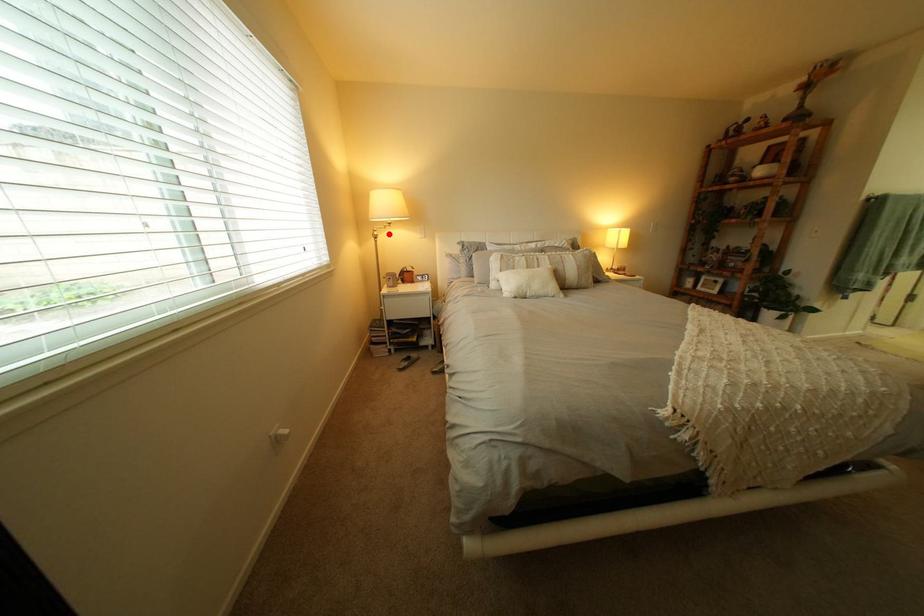
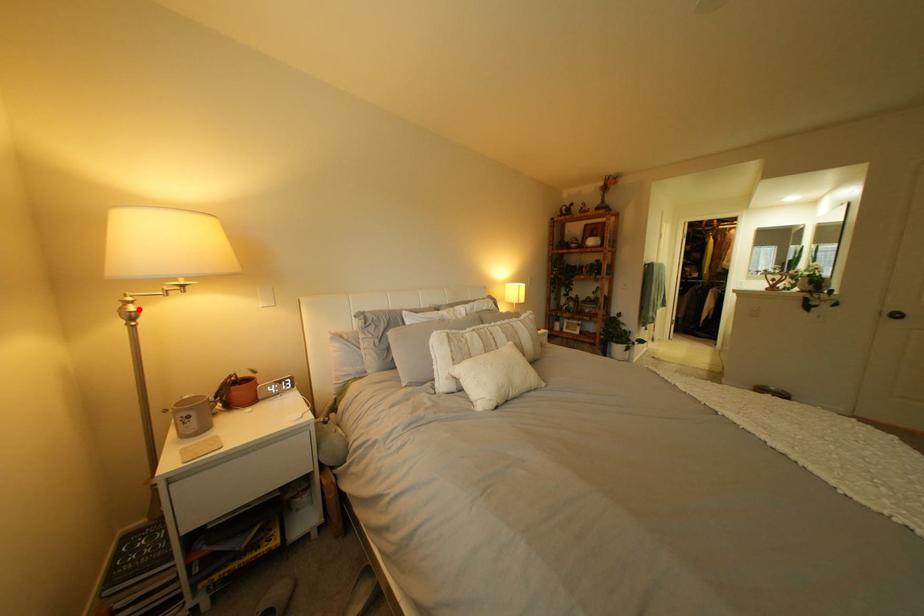
I am providing you with two images of the same scene from different viewpoints. A red point is marked on the first image and another point is marked on the second image. Is the red point in image1 aligned with the point shown in image2?

Yes